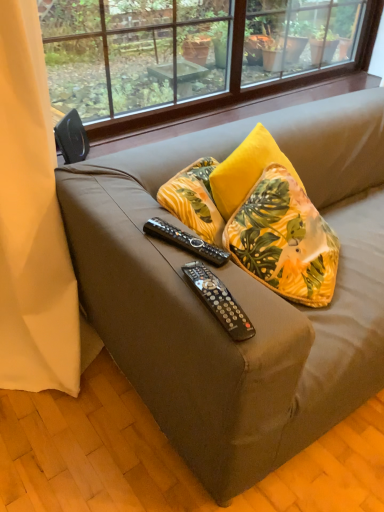
Find the location of a particular element. Image resolution: width=384 pixels, height=512 pixels. vacant space that is to the left of black plastic remote control at center, which is the 2th remote control from bottom to top is located at coordinates (130, 230).